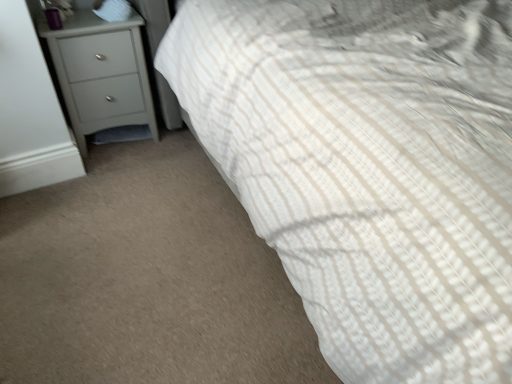
Question: Should I look upward or downward to see white soft pillow at upper left?

Choices:
 (A) up
 (B) down

Answer: (A)

Question: Would you say matte gray chest of drawers at left is a long distance from white soft pillow at upper left?

Choices:
 (A) yes
 (B) no

Answer: (B)

Question: Considering the relative sizes of matte gray chest of drawers at left and white soft pillow at upper left in the image provided, is matte gray chest of drawers at left taller than white soft pillow at upper left?

Choices:
 (A) no
 (B) yes

Answer: (B)

Question: From the image's perspective, is matte gray chest of drawers at left on top of white soft pillow at upper left?

Choices:
 (A) no
 (B) yes

Answer: (A)

Question: Is matte gray chest of drawers at left facing away from white soft pillow at upper left?

Choices:
 (A) yes
 (B) no

Answer: (B)

Question: Can you confirm if matte gray chest of drawers at left is shorter than white soft pillow at upper left?

Choices:
 (A) no
 (B) yes

Answer: (A)

Question: Is matte gray chest of drawers at left bigger than white soft pillow at upper left?

Choices:
 (A) no
 (B) yes

Answer: (B)

Question: Does white soft pillow at upper left come behind matte gray chest of drawers at left?

Choices:
 (A) no
 (B) yes

Answer: (B)

Question: Is white soft pillow at upper left bigger than matte gray chest of drawers at left?

Choices:
 (A) yes
 (B) no

Answer: (B)

Question: Can you confirm if white soft pillow at upper left is thinner than matte gray chest of drawers at left?

Choices:
 (A) yes
 (B) no

Answer: (A)

Question: Is the depth of white soft pillow at upper left less than that of matte gray chest of drawers at left?

Choices:
 (A) yes
 (B) no

Answer: (B)

Question: From a real-world perspective, is white soft pillow at upper left positioned under matte gray chest of drawers at left based on gravity?

Choices:
 (A) yes
 (B) no

Answer: (B)

Question: Can you confirm if white soft pillow at upper left is wider than matte gray chest of drawers at left?

Choices:
 (A) yes
 (B) no

Answer: (B)

Question: From the image's perspective, is matte gray chest of drawers at left above or below white soft pillow at upper left?

Choices:
 (A) below
 (B) above

Answer: (A)